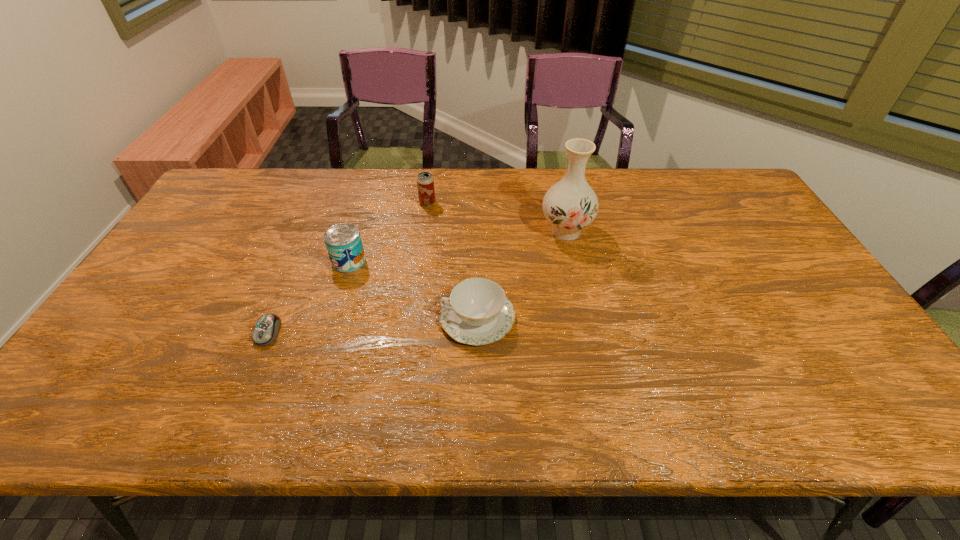
I want to click on unoccupied position between the chinaware and the shortest object, so click(x=372, y=325).

Identify the location of blank region between the beer can and the rightmost object. Image resolution: width=960 pixels, height=540 pixels. (496, 217).

Locate an element on the screen. This screenshot has width=960, height=540. vacant area that lies between the fourth tallest object and the beer can is located at coordinates (452, 260).

This screenshot has height=540, width=960. Identify the location of vacant space that is in between the fourth nearest object and the computer mouse. (417, 282).

Where is `the second closest object relative to the second shortest object`? Image resolution: width=960 pixels, height=540 pixels. the second closest object relative to the second shortest object is located at coordinates click(343, 241).

The image size is (960, 540). I want to click on object that can be found as the third closest to the shortest object, so click(x=425, y=183).

You are a GUI agent. You are given a task and a screenshot of the screen. Output one action in this format:
    pyautogui.click(x=<x>, y=<y>)
    Task: Click on the blank space that satisfies the following two spatial constraints: 1. on the handle side of the second object from right to left; 2. on the wheel side of the shortest object
    The height and width of the screenshot is (540, 960).
    Given the screenshot: What is the action you would take?
    pyautogui.click(x=477, y=332)

Find the location of a particular element. Image resolution: width=960 pixels, height=540 pixels. vacant space that satisfies the following two spatial constraints: 1. on the back side of the third nearest object; 2. on the left side of the tallest object is located at coordinates coord(358,231).